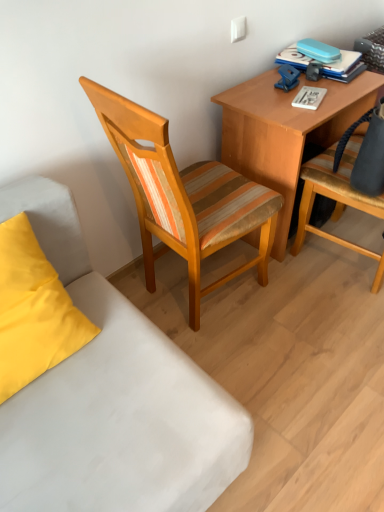
The width and height of the screenshot is (384, 512). In order to click on free space that is in between striped fabric chair at right, placed as the 2th chair when sorted from left to right, and wooden desk at upper right in this screenshot , I will do [329, 268].